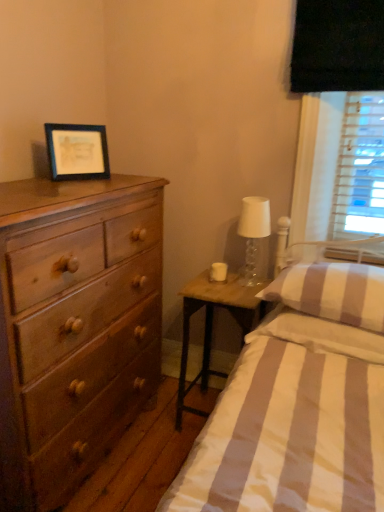
I want to click on vacant area in front of white glass candle holder at right, so click(x=231, y=287).